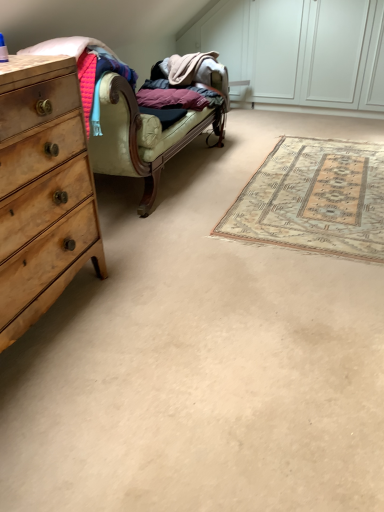
Question: Is wooden chest of drawers at left closer to camera compared to beige woven rug at center?

Choices:
 (A) yes
 (B) no

Answer: (A)

Question: Is wooden chest of drawers at left looking in the opposite direction of beige woven rug at center?

Choices:
 (A) yes
 (B) no

Answer: (B)

Question: Can you confirm if wooden chest of drawers at left is shorter than beige woven rug at center?

Choices:
 (A) no
 (B) yes

Answer: (A)

Question: From a real-world perspective, is wooden chest of drawers at left positioned under beige woven rug at center based on gravity?

Choices:
 (A) yes
 (B) no

Answer: (B)

Question: Is wooden chest of drawers at left smaller than beige woven rug at center?

Choices:
 (A) yes
 (B) no

Answer: (B)

Question: In the image, is beige woven rug at center on the left side or the right side of velvet green couch at center?

Choices:
 (A) right
 (B) left

Answer: (A)

Question: From the image's perspective, is beige woven rug at center above or below velvet green couch at center?

Choices:
 (A) below
 (B) above

Answer: (A)

Question: From their relative heights in the image, would you say beige woven rug at center is taller or shorter than velvet green couch at center?

Choices:
 (A) tall
 (B) short

Answer: (B)

Question: Based on their sizes in the image, would you say beige woven rug at center is bigger or smaller than velvet green couch at center?

Choices:
 (A) big
 (B) small

Answer: (B)

Question: Is point (107, 147) positioned closer to the camera than point (360, 150)?

Choices:
 (A) closer
 (B) farther

Answer: (A)

Question: From a real-world perspective, is velvet green couch at center positioned above or below beige woven rug at center?

Choices:
 (A) below
 (B) above

Answer: (B)

Question: In the image, is velvet green couch at center positioned in front of or behind beige woven rug at center?

Choices:
 (A) behind
 (B) front

Answer: (B)

Question: Looking at their shapes, would you say velvet green couch at center is wider or thinner than beige woven rug at center?

Choices:
 (A) thin
 (B) wide

Answer: (A)

Question: From the image's perspective, is wooden chest of drawers at left located above or below beige woven rug at center?

Choices:
 (A) above
 (B) below

Answer: (B)

Question: In the image, is wooden chest of drawers at left positioned in front of or behind beige woven rug at center?

Choices:
 (A) front
 (B) behind

Answer: (A)